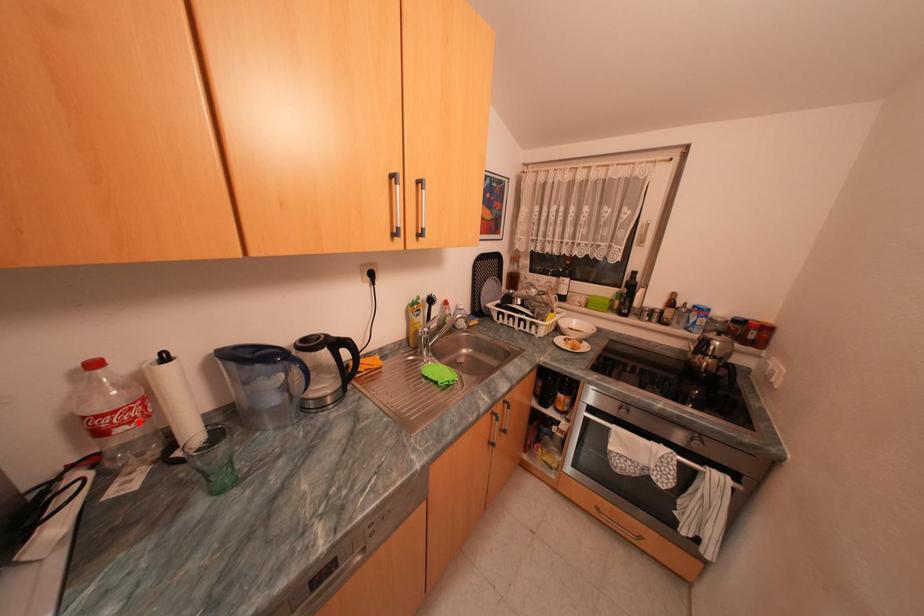
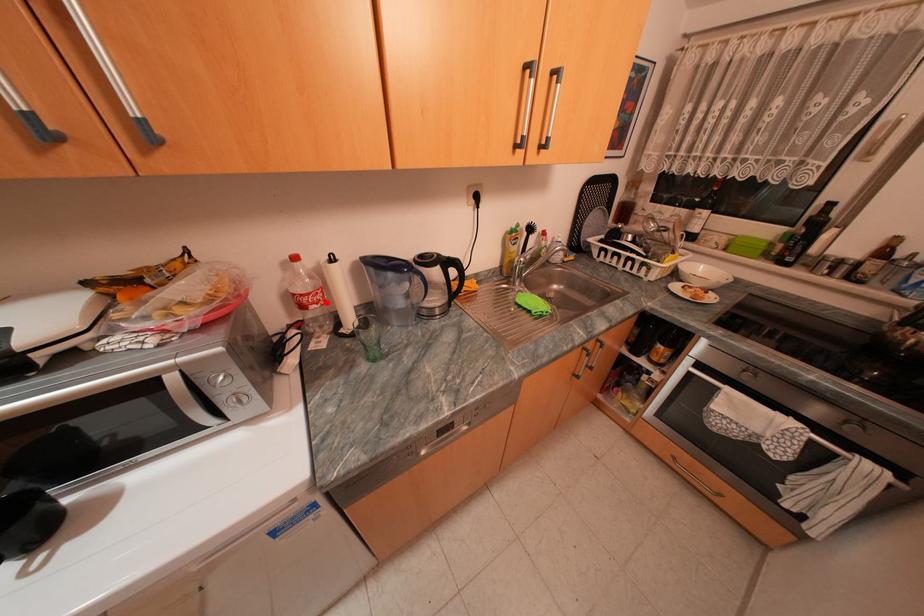
I am providing you with two images of the same scene from different viewpoints. A red point is marked on the first image and another point is marked on the second image. Do the highlighted points in image1 and image2 indicate the same real-world spot?

Yes